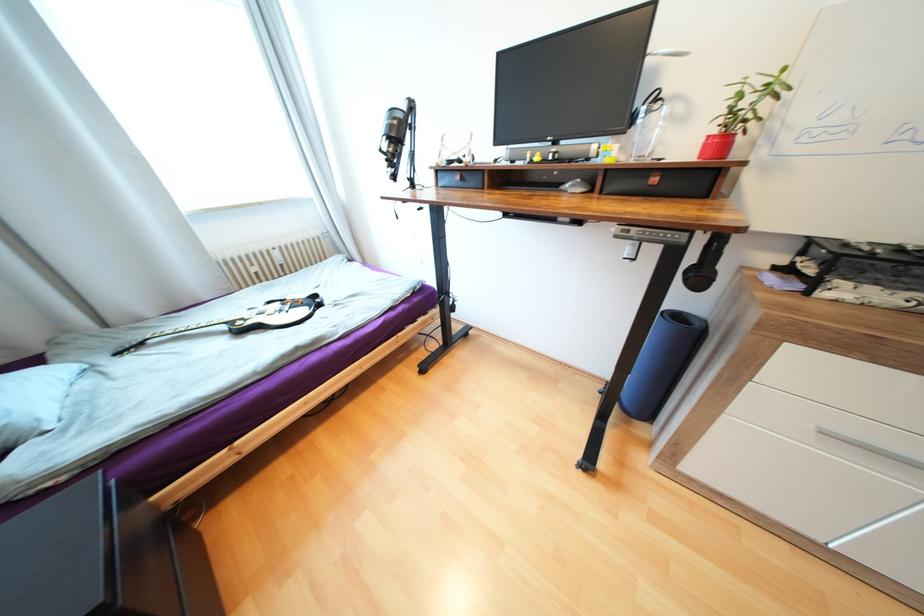
Identify the location of desk control panel. The height and width of the screenshot is (616, 924). (650, 233).